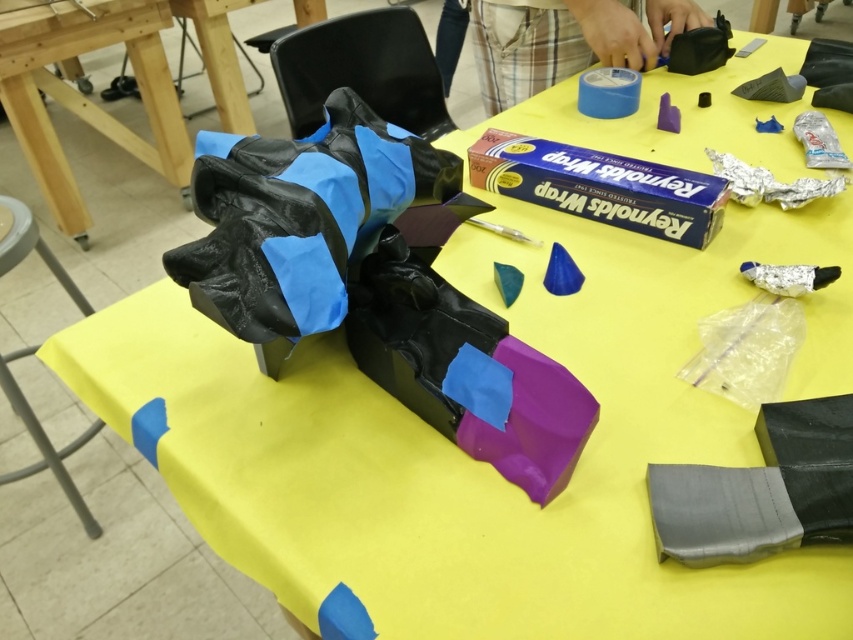
Which is in front, point (383, 176) or point (111, 125)?

Point (383, 176) is in front.

Who is shorter, matte black glove at center or yellow matte table at center?

matte black glove at center is shorter.

What do you see at coordinates (300, 218) in the screenshot?
I see `matte black glove at center` at bounding box center [300, 218].

Locate an element on the screen. matte black glove at center is located at coordinates (300, 218).

Which is more to the right, matte black glove at center or blue matte tape at upper center?

blue matte tape at upper center

Image resolution: width=853 pixels, height=640 pixels. In order to click on matte black glove at center in this screenshot , I will do `click(300, 218)`.

Can you confirm if yellow matte table at center is positioned below blue matte tape at upper center?

Actually, yellow matte table at center is above blue matte tape at upper center.

Who is positioned more to the left, yellow matte table at center or blue matte tape at upper center?

Positioned to the left is yellow matte table at center.

Between point (135, 42) and point (664, 42), which one is positioned behind?

The point (135, 42) is behind.

You are a GUI agent. You are given a task and a screenshot of the screen. Output one action in this format:
    pyautogui.click(x=<x>, y=<y>)
    Task: Click on the yellow matte table at center
    This screenshot has width=853, height=640.
    Given the screenshot: What is the action you would take?
    pyautogui.click(x=85, y=97)